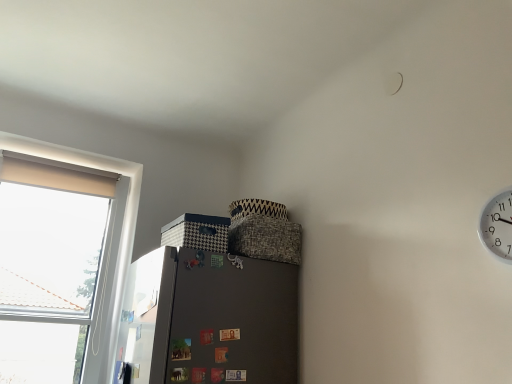
I want to click on white fabric window at left, so click(x=105, y=242).

Which object is further away from the camera, metallic silver screen door at left or white fabric window at left?

white fabric window at left is more distant.

Is metallic silver screen door at left next to white fabric window at left and touching it?

There is a gap between metallic silver screen door at left and white fabric window at left.

Considering the positions of objects metallic silver screen door at left and white fabric window at left in the image provided, who is more to the right, metallic silver screen door at left or white fabric window at left?

Positioned to the right is metallic silver screen door at left.

In the scene shown: From a real-world perspective, who is located lower, metallic silver screen door at left or white fabric window at left?

Result: metallic silver screen door at left is physically lower.

Is point (136, 187) closer to viewer compared to point (501, 239)?

That is False.

Relative to white plastic clock at upper right, is white fabric window at left in front or behind?

white fabric window at left is behind white plastic clock at upper right.

Could you tell me if white fabric window at left is turned towards white plastic clock at upper right?

No, white fabric window at left is not aimed at white plastic clock at upper right.

Which of these two, white fabric window at left or white plastic clock at upper right, is bigger?

white fabric window at left is bigger.

Considering the sizes of metallic silver screen door at left and white plastic clock at upper right in the image, is metallic silver screen door at left wider or thinner than white plastic clock at upper right?

In the image, metallic silver screen door at left appears to be more narrow than white plastic clock at upper right.

From the image's perspective, between metallic silver screen door at left and white plastic clock at upper right, who is located below?

metallic silver screen door at left, from the image's perspective.

Is metallic silver screen door at left to the right of white plastic clock at upper right from the viewer's perspective?

In fact, metallic silver screen door at left is to the left of white plastic clock at upper right.

From the picture: Is white plastic clock at upper right to the left of metallic silver screen door at left from the viewer's perspective?

No.

Is white plastic clock at upper right wider than metallic silver screen door at left?

Correct, the width of white plastic clock at upper right exceeds that of metallic silver screen door at left.

This screenshot has width=512, height=384. Find the location of `clock above the metallic silver screen door at left (from the image's perspective)`. clock above the metallic silver screen door at left (from the image's perspective) is located at coordinates (497, 226).

Based on their positions, is white fabric window at left located to the left or right of metallic silver screen door at left?

white fabric window at left is to the left of metallic silver screen door at left.

Which object is wider, white fabric window at left or metallic silver screen door at left?

white fabric window at left.

Which is in front, point (16, 137) or point (169, 255)?

The point (169, 255) is in front.

Are white fabric window at left and metallic silver screen door at left far apart?

No.

What's the angular difference between white plastic clock at upper right and white fabric window at left's facing directions?

The facing directions of white plastic clock at upper right and white fabric window at left are 88.9 degrees apart.

Identify the location of window on the left of white plastic clock at upper right. This screenshot has width=512, height=384. (105, 242).

Is white plastic clock at upper right in front of or behind white fabric window at left in the image?

white plastic clock at upper right is positioned closer to the viewer than white fabric window at left.

Locate an element on the screen. This screenshot has height=384, width=512. screen door in front of the white fabric window at left is located at coordinates (147, 317).

You are a GUI agent. You are given a task and a screenshot of the screen. Output one action in this format:
    pyautogui.click(x=<x>, y=<y>)
    Task: Click on the window behind the white plastic clock at upper right
    
    Given the screenshot: What is the action you would take?
    pyautogui.click(x=105, y=242)

Consider the image. Estimate the real-world distances between objects in this image. Which object is further from white plastic clock at upper right, metallic silver screen door at left or white fabric window at left?

Among the two, white fabric window at left is located further to white plastic clock at upper right.

Based on their spatial positions, is white fabric window at left or white plastic clock at upper right closer to metallic silver screen door at left?

The object closer to metallic silver screen door at left is white fabric window at left.

Considering their positions, is white fabric window at left positioned closer to white plastic clock at upper right than metallic silver screen door at left?

metallic silver screen door at left lies closer to white plastic clock at upper right than the other object.

From the image, which object appears to be farther from metallic silver screen door at left, white plastic clock at upper right or white fabric window at left?

white plastic clock at upper right lies further to metallic silver screen door at left than the other object.

Considering their positions, is white plastic clock at upper right positioned closer to white fabric window at left than metallic silver screen door at left?

metallic silver screen door at left is positioned closer to the anchor white fabric window at left.

Looking at the image, which one is located further to white fabric window at left, metallic silver screen door at left or white plastic clock at upper right?

white plastic clock at upper right.

The width and height of the screenshot is (512, 384). Identify the location of screen door between white fabric window at left and white plastic clock at upper right. (147, 317).